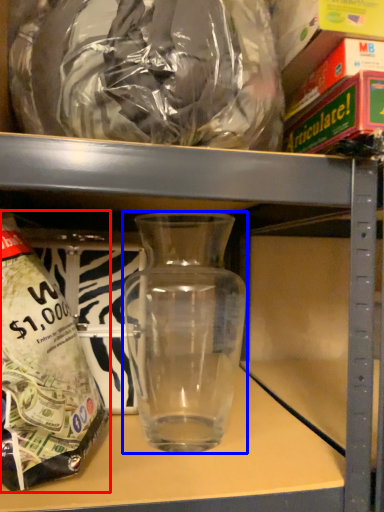
Question: Among these objects, which one is farthest to the camera, bottle (highlighted by a red box) or vase (highlighted by a blue box)?

Choices:
 (A) bottle
 (B) vase

Answer: (B)